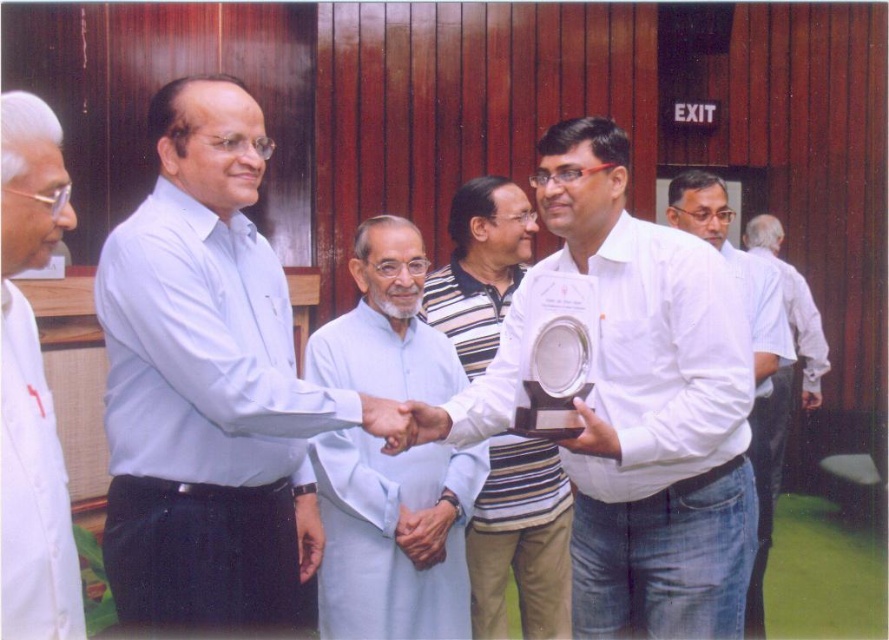
Is light blue fabric at center to the left of white cotton shirt at right from the viewer's perspective?

Indeed, light blue fabric at center is positioned on the left side of white cotton shirt at right.

Where is `light blue fabric at center`? light blue fabric at center is located at coordinates (393, 538).

In order to click on light blue fabric at center in this screenshot , I will do `click(393, 538)`.

Can you confirm if light blue shirt at center is wider than white cloth at left?

Indeed, light blue shirt at center has a greater width compared to white cloth at left.

Who is lower down, light blue shirt at center or white cloth at left?

light blue shirt at center is lower down.

Image resolution: width=889 pixels, height=640 pixels. Identify the location of light blue shirt at center. (206, 385).

Who is more distant from viewer, (x=39, y=157) or (x=802, y=320)?

The point (x=802, y=320) is behind.

This screenshot has width=889, height=640. I want to click on white cloth at left, so click(x=31, y=387).

Who is more forward, [10,406] or [771,401]?

Answer: Point [10,406] is more forward.

Where is `white cloth at left`? Image resolution: width=889 pixels, height=640 pixels. white cloth at left is located at coordinates (31, 387).